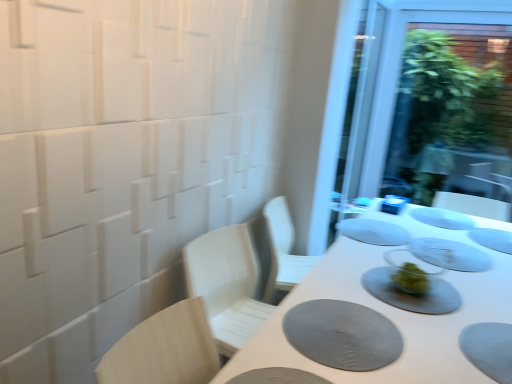
I want to click on free area behind gray textured placemat at lower right, so click(343, 284).